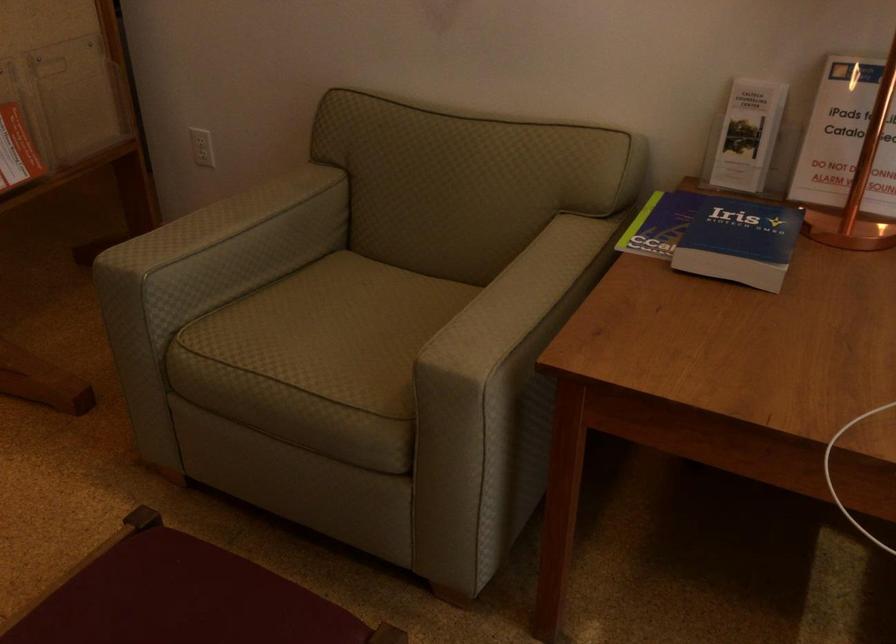
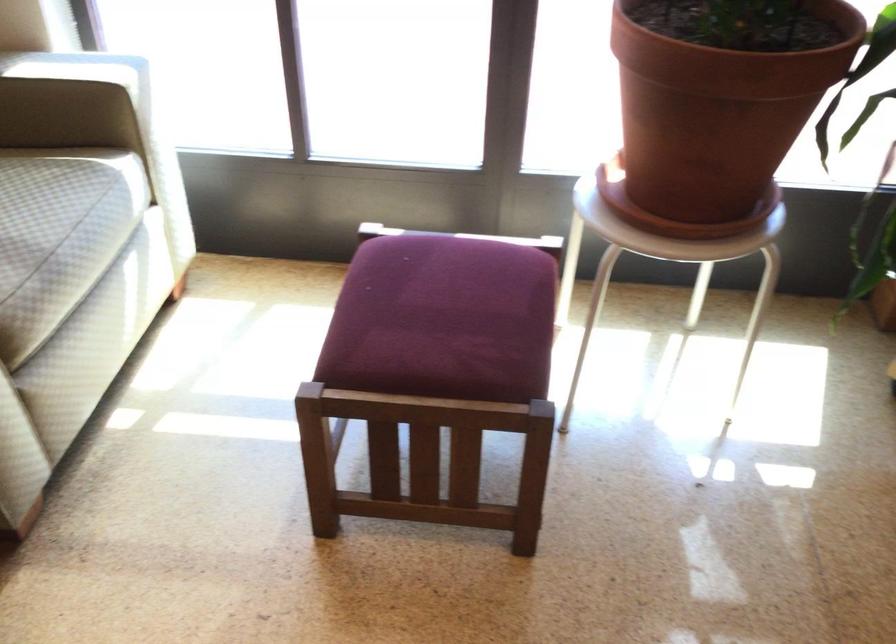
First-person continuous shooting, in which direction is the camera rotating?

The camera's rotation is toward right-down.